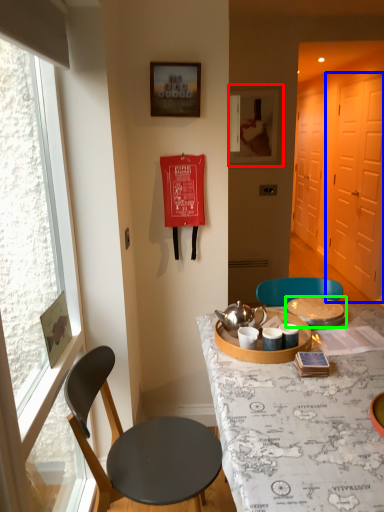
Question: Which object is the farthest from picture frame (highlighted by a red box)? Choose among these: screen door (highlighted by a blue box) or tableware (highlighted by a green box).

Choices:
 (A) screen door
 (B) tableware

Answer: (B)